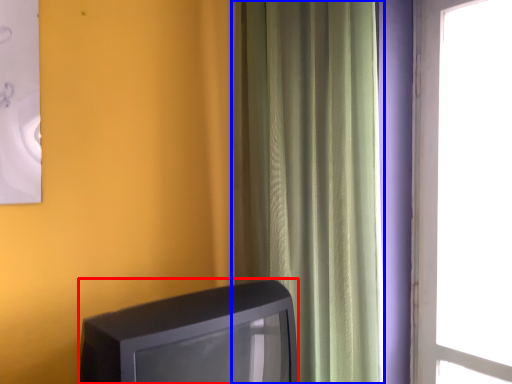
Question: Which of the following is the farthest to the observer, television (highlighted by a red box) or curtain (highlighted by a blue box)?

Choices:
 (A) television
 (B) curtain

Answer: (B)